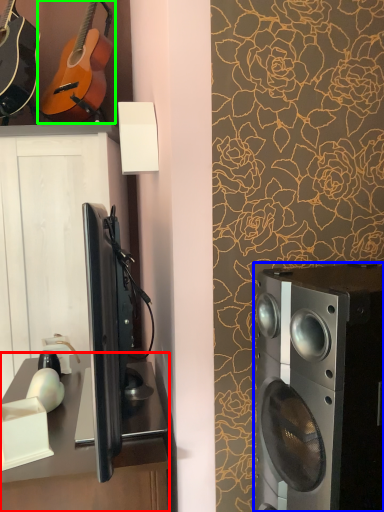
Question: Which is nearer to the desk (highlighted by a red box)? home appliance (highlighted by a blue box) or guitar (highlighted by a green box).

Choices:
 (A) home appliance
 (B) guitar

Answer: (A)